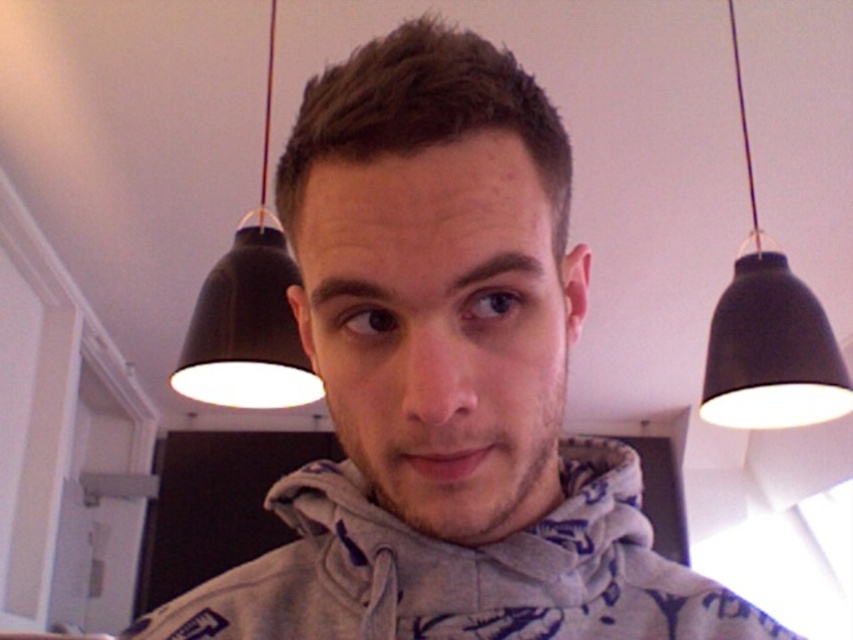
Who is taller, black matte lampshade at upper center or black matte lampshade at upper left?

With more height is black matte lampshade at upper center.

Can you confirm if black matte lampshade at upper center is wider than black matte lampshade at upper left?

Indeed, black matte lampshade at upper center has a greater width compared to black matte lampshade at upper left.

Does point (737, 314) come in front of point (213, 369)?

Yes, point (737, 314) is closer to viewer.

At what (x,y) coordinates should I click in order to perform the action: click on black matte lampshade at upper center. Please return your answer as a coordinate pair (x, y). Looking at the image, I should click on (769, 333).